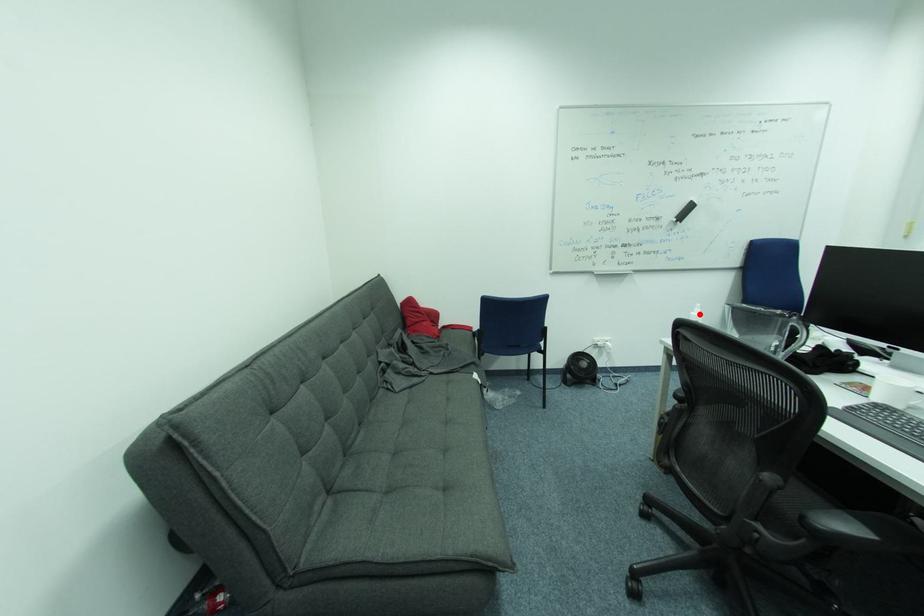
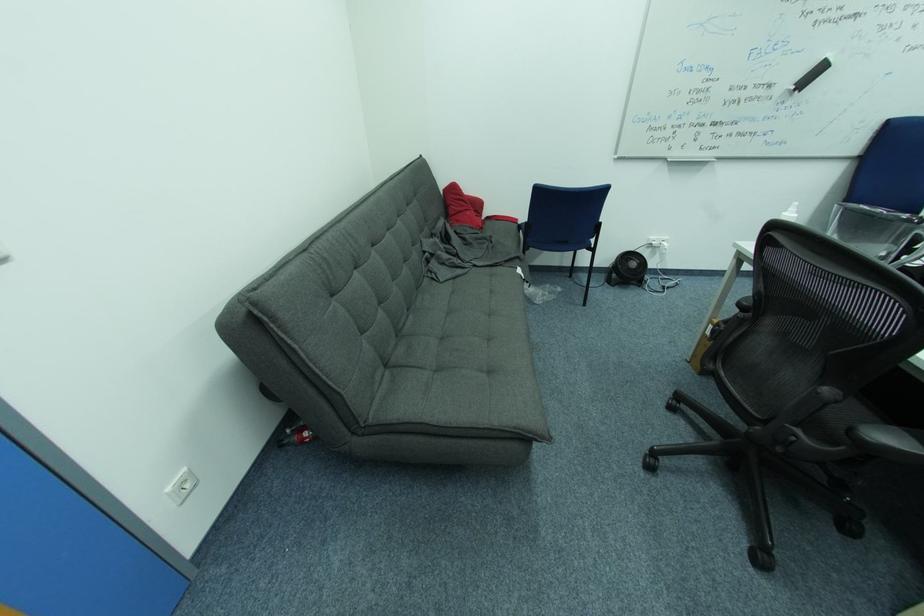
Question: I am providing you with two images of the same scene from different viewpoints. A red point is shown in image1. For the corresponding object point in image2, is it positioned nearer or farther from the camera?

Choices:
 (A) Nearer
 (B) Farther

Answer: (A)